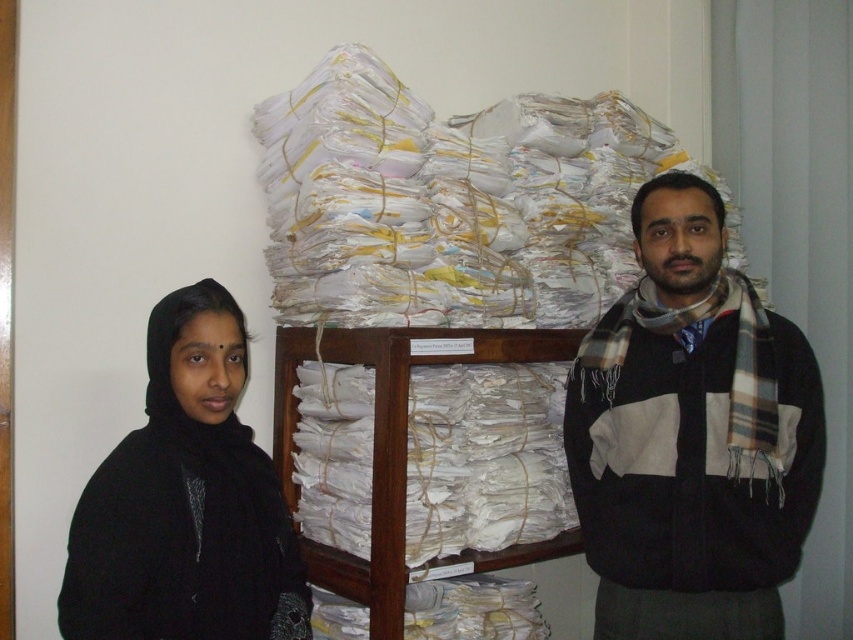
Question: Is plaid scarf at right closer to the viewer compared to black matte/black fabric at left?

Choices:
 (A) yes
 (B) no

Answer: (B)

Question: Which point is farther to the camera?

Choices:
 (A) (712, 436)
 (B) (345, 323)

Answer: (B)

Question: Can you confirm if plaid scarf at right is positioned to the right of black matte/black fabric at left?

Choices:
 (A) yes
 (B) no

Answer: (A)

Question: Which of the following is the farthest from the observer?

Choices:
 (A) plaid scarf at right
 (B) white paper at center

Answer: (B)

Question: Which of these objects is positioned farthest from the black matte/black fabric at left?

Choices:
 (A) plaid scarf at right
 (B) white paper at center

Answer: (A)

Question: Can you confirm if plaid scarf at right is smaller than black matte/black fabric at left?

Choices:
 (A) yes
 (B) no

Answer: (B)